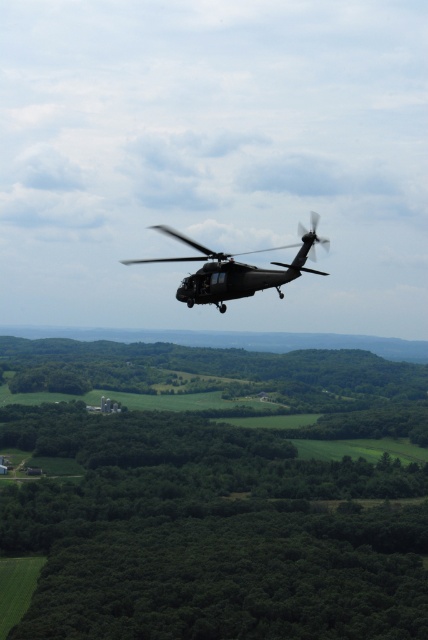
You are a pilot flying the metallic gray helicopter at center. You need to land in an open area. Considering the green leafy trees at center are wider than the helicopter, can you safely land between them?

The green leafy trees at center are wider than the metallic gray helicopter at center, so yes, you can safely land between them as there is enough space.

You are a pilot flying the metallic gray helicopter at center. You need to land in an open field. Which direction should you head relative to the green leafy trees at center?

The green leafy trees at center are located below the metallic gray helicopter at center, so to find an open field for landing, you should head away from the green leafy trees at center and look for clear areas in other directions.